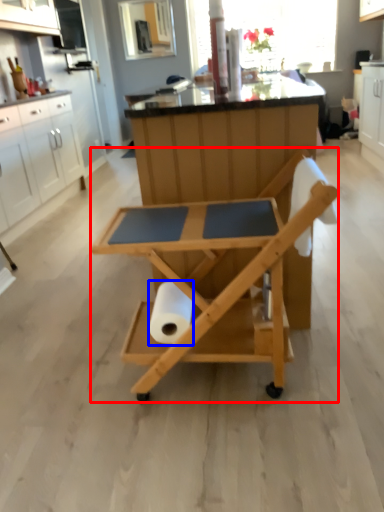
Question: Which object appears closest to the camera in this image, table (highlighted by a red box) or paper towel (highlighted by a blue box)?

Choices:
 (A) table
 (B) paper towel

Answer: (A)